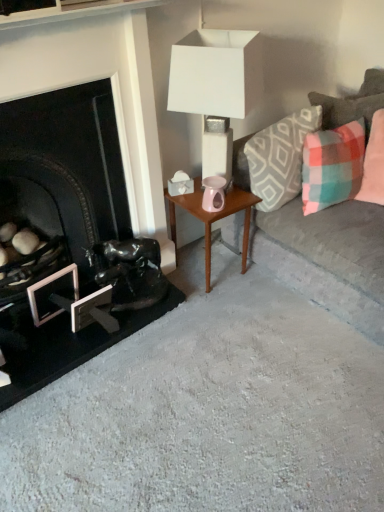
Question: Is point (228, 201) positioned closer to the camera than point (41, 284)?

Choices:
 (A) farther
 (B) closer

Answer: (A)

Question: Considering the positions of wooden side table at center and metallic silver picture frame at lower left in the image, is wooden side table at center wider or thinner than metallic silver picture frame at lower left?

Choices:
 (A) wide
 (B) thin

Answer: (A)

Question: Estimate the real-world distances between objects in this image. Which object is farther from the plaid fabric pillow at right?

Choices:
 (A) shiny black sculpture at lower left
 (B) plaid fabric pillow at right, which is counted as the 3th pillow, starting from the left
 (C) plush gray couch at right
 (D) wooden side table at center
 (E) plaid fabric pillow at upper right, the 2th pillow when ordered from left to right

Answer: (A)

Question: Which of these objects is positioned closest to the shiny black sculpture at lower left?

Choices:
 (A) plaid fabric pillow at right, which is counted as the 3th pillow, starting from the left
 (B) plaid fabric pillow at upper right, the second pillow in the right-to-left sequence
 (C) metallic silver picture frame at lower left
 (D) plush gray couch at right
 (E) plaid fabric pillow at right

Answer: (C)